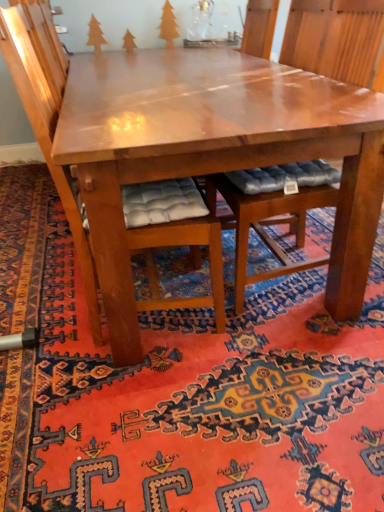
Where is `blank space to the left of wooden cushioned chair at center, the first chair in the left-to-right sequence`? Image resolution: width=384 pixels, height=512 pixels. blank space to the left of wooden cushioned chair at center, the first chair in the left-to-right sequence is located at coordinates (38, 314).